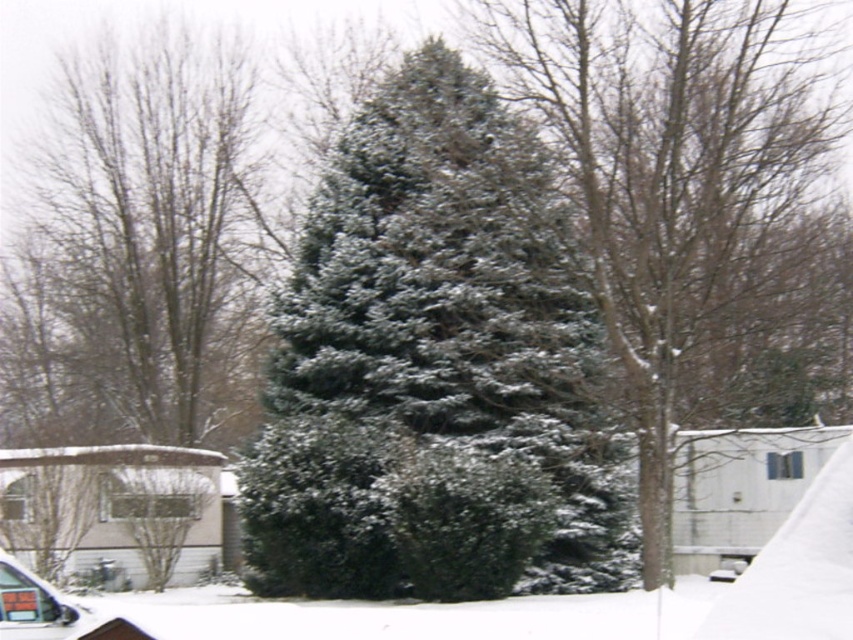
Who is taller, green matte fir tree at center or green matte evergreen tree at center?

green matte evergreen tree at center

Which is below, green matte fir tree at center or green matte evergreen tree at center?

green matte fir tree at center

Between point (326, 580) and point (26, 376), which one is positioned in front?

Point (326, 580)

Where is `green matte fir tree at center`? The width and height of the screenshot is (853, 640). green matte fir tree at center is located at coordinates (x=457, y=307).

Which of these two, green matte evergreen at center or metallic silver car at lower left, stands taller?

With more height is green matte evergreen at center.

Is green matte evergreen at center above metallic silver car at lower left?

Indeed, green matte evergreen at center is positioned over metallic silver car at lower left.

Is point (692, 392) positioned in front of point (27, 608)?

No, it is behind (27, 608).

At what (x,y) coordinates should I click in order to perform the action: click on green matte evergreen at center. Please return your answer as a coordinate pair (x, y). Looking at the image, I should click on (672, 179).

Who is taller, green matte evergreen at center or green matte evergreen tree at center?

green matte evergreen tree at center is taller.

Who is more distant from viewer, (686, 118) or (135, 147)?

The point (135, 147) is more distant.

Locate an element on the screen. This screenshot has width=853, height=640. green matte evergreen at center is located at coordinates (672, 179).

The width and height of the screenshot is (853, 640). What are the coordinates of `green matte evergreen at center` in the screenshot? It's located at (672, 179).